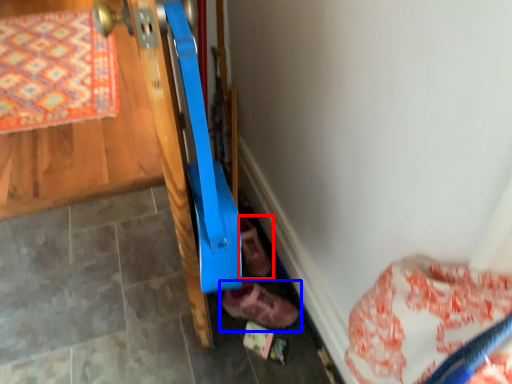
Question: Which of the following is the closest to the observer, footwear (highlighted by a red box) or footwear (highlighted by a blue box)?

Choices:
 (A) footwear
 (B) footwear

Answer: (B)